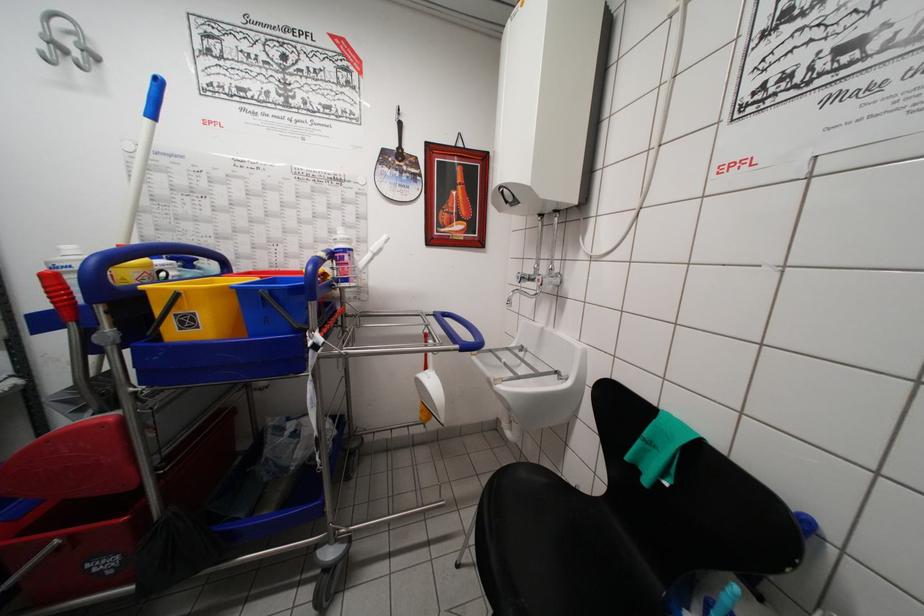
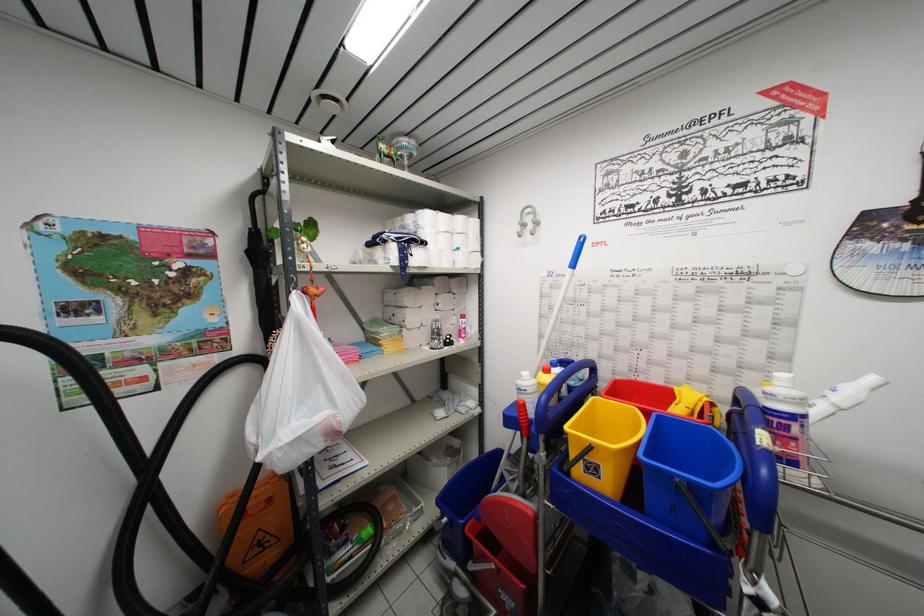
Locate, in the second image, the point that corresponds to pixel 343 261 in the first image.

(783, 428)